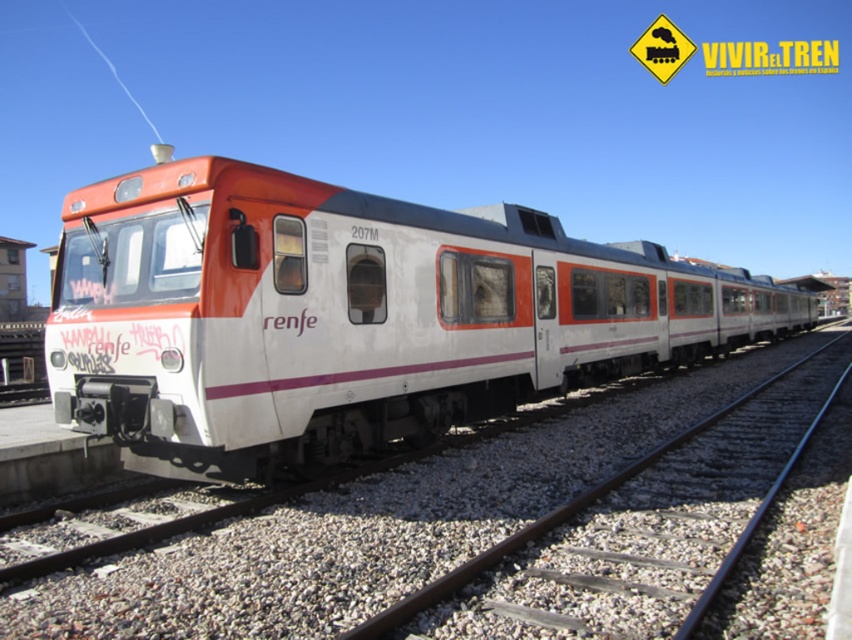
You are standing on the platform and see the white matte train at center and the metal at center. Which object is closer to you?

The white matte train at center is closer to you because it is positioned further to the viewer than the metal at center.

You are standing at point A which is located at coordinates 0.3, 0.3. You want to walk to the white matte train at center. Which direction should you move in to reach it?

You should move towards the northeast direction to reach the white matte train at center located at point (350, 316) from your current position at (255, 192).